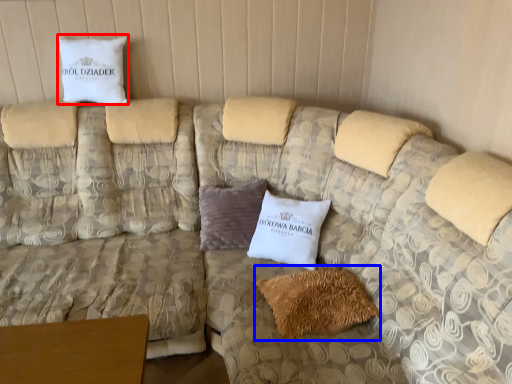
Question: Which object is further to the camera taking this photo, pillow (highlighted by a red box) or pillow (highlighted by a blue box)?

Choices:
 (A) pillow
 (B) pillow

Answer: (A)